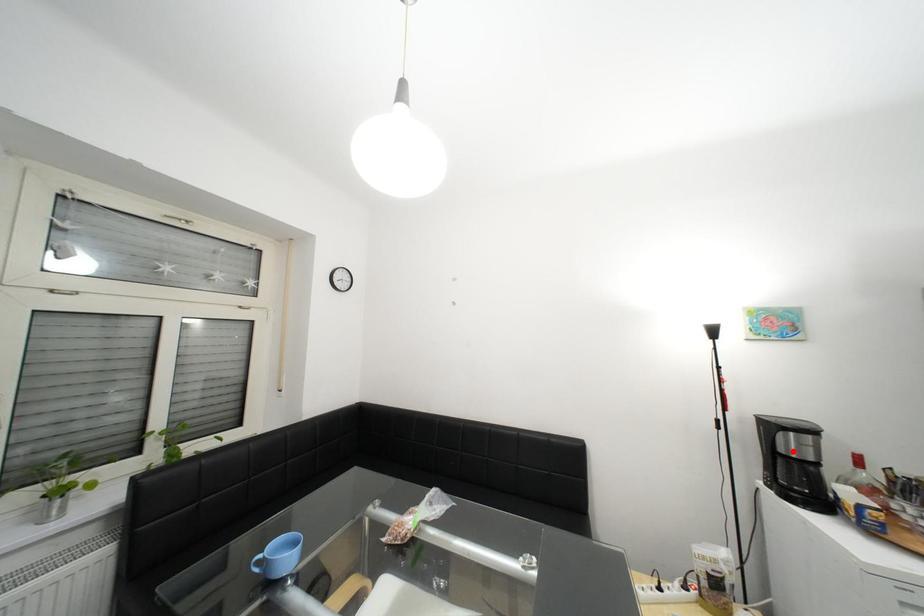
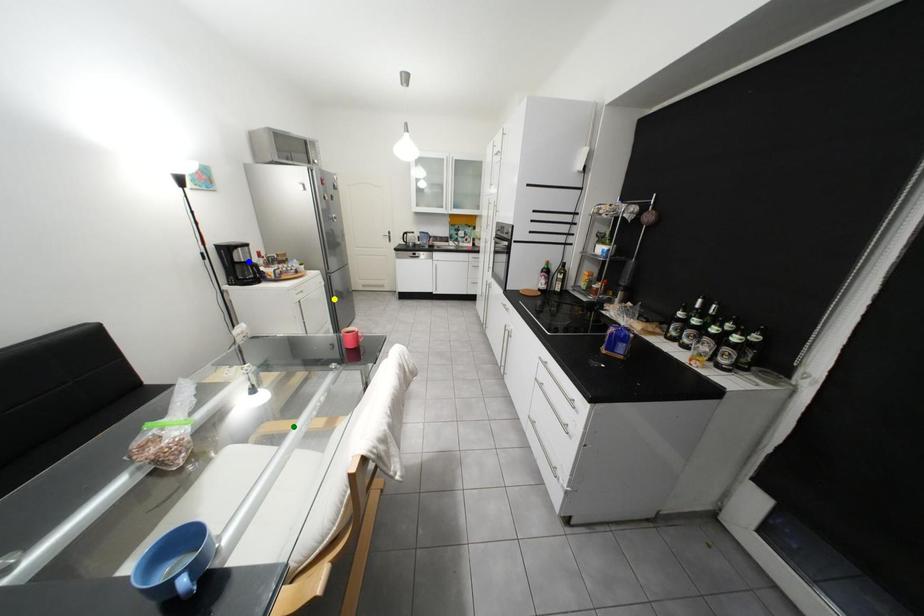
Question: I am providing you with two images of the same scene from different viewpoints. A red point is marked on the first image. You are given multiple points on the second image. Which point in image 2 is actually the same real-world point as the red point in image 1?

Choices:
 (A) yellow point
 (B) green point
 (C) blue point

Answer: (C)